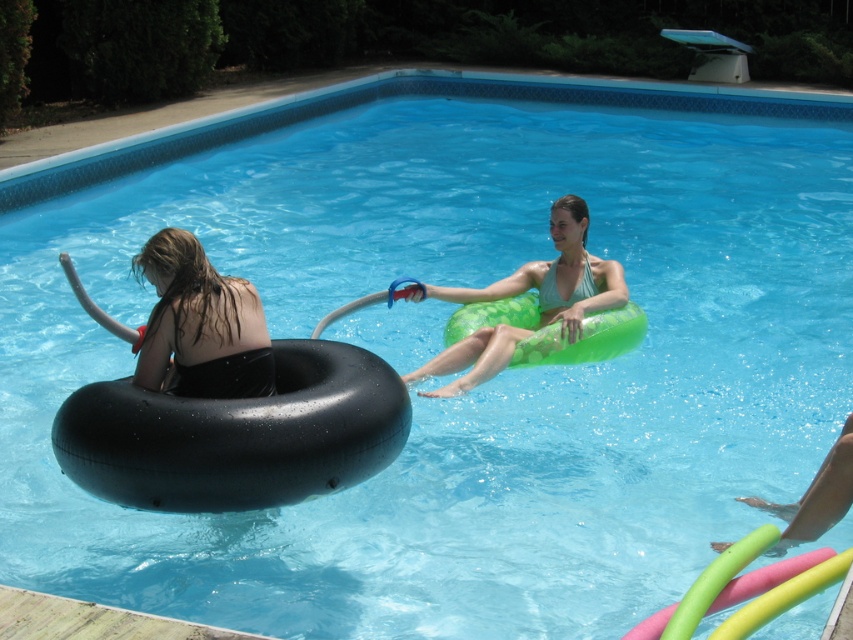
Question: Does black rubber tube at left have a lesser width compared to green rubber ring at center?

Choices:
 (A) no
 (B) yes

Answer: (B)

Question: Which object appears farthest from the camera in this image?

Choices:
 (A) black rubber tube at left
 (B) green rubber ring at center

Answer: (B)

Question: Does black rubber tube at left lie in front of green rubber ring at center?

Choices:
 (A) no
 (B) yes

Answer: (B)

Question: Which point is closer to the camera?

Choices:
 (A) green rubber ring at center
 (B) black rubber tube at left

Answer: (B)

Question: Which point is closer to the camera?

Choices:
 (A) black rubber tube at left
 (B) green rubber ring at center

Answer: (A)

Question: Does black rubber tube at left lie behind green rubber ring at center?

Choices:
 (A) no
 (B) yes

Answer: (A)